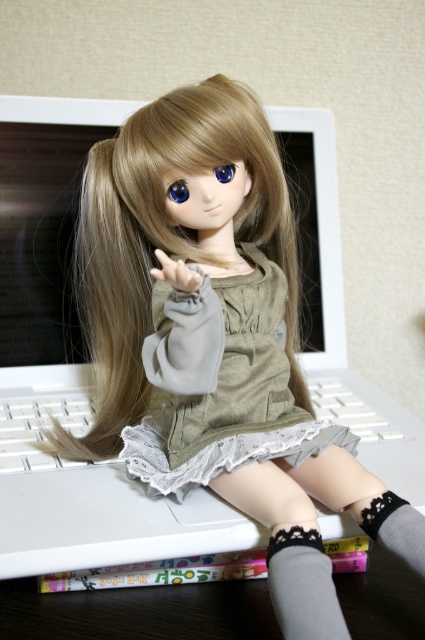
Question: Which of the following is the farthest from the observer?

Choices:
 (A) (5, 429)
 (B) (108, 625)
 (C) (258, 166)

Answer: (A)

Question: Where is brown silky hair at center located in relation to dark wood table at lower center in the image?

Choices:
 (A) left
 (B) right

Answer: (A)

Question: Which object is positioned closest to the gray lace sock at lower center?

Choices:
 (A) brown silky hair at center
 (B) white plastic keyboard at center
 (C) dark wood table at lower center
 (D) olive green fabric dress at center

Answer: (D)

Question: Can you confirm if dark wood table at lower center is positioned to the right of gray lace sock at lower center?

Choices:
 (A) yes
 (B) no

Answer: (B)

Question: Is dark wood table at lower center smaller than gray lace sock at lower center?

Choices:
 (A) no
 (B) yes

Answer: (A)

Question: Which object is positioned farthest from the gray lace sock at lower center?

Choices:
 (A) gray knitted sock at lower right
 (B) brown silky hair at center
 (C) white plastic keyboard at center
 (D) olive green fabric dress at center

Answer: (B)